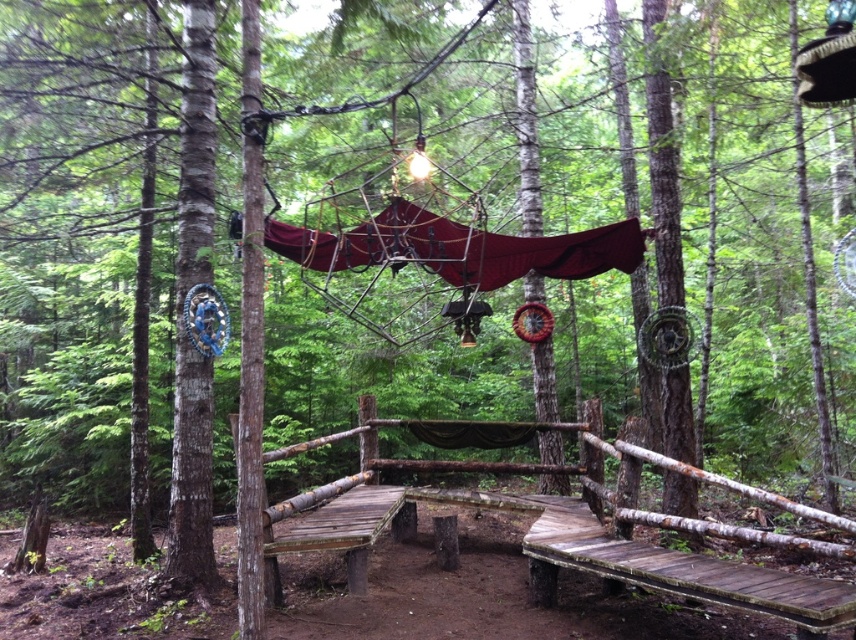
Which of these two, wooden park bench at lower right or weathered wood bench at center, stands shorter?

Standing shorter between the two is wooden park bench at lower right.

Does point (836, 589) come farther from viewer compared to point (265, 576)?

No, it is not.

Is point (803, 586) farther from camera compared to point (265, 579)?

No, (803, 586) is closer to viewer.

Locate an element on the screen. wooden park bench at lower right is located at coordinates (685, 570).

Is weathered wood bench at center closer to the viewer compared to brown wood bench at center?

Yes, it is in front of brown wood bench at center.

Which is in front, point (318, 536) or point (440, 561)?

Point (318, 536)

Describe the element at coordinates (336, 532) in the screenshot. I see `weathered wood bench at center` at that location.

The image size is (856, 640). Identify the location of weathered wood bench at center. (336, 532).

Where is `burgundy fabric canopy at center`? burgundy fabric canopy at center is located at coordinates (459, 248).

Which is behind, point (514, 246) or point (354, 577)?

Positioned behind is point (514, 246).

Find the location of a particular element. This screenshot has width=856, height=640. burgundy fabric canopy at center is located at coordinates (459, 248).